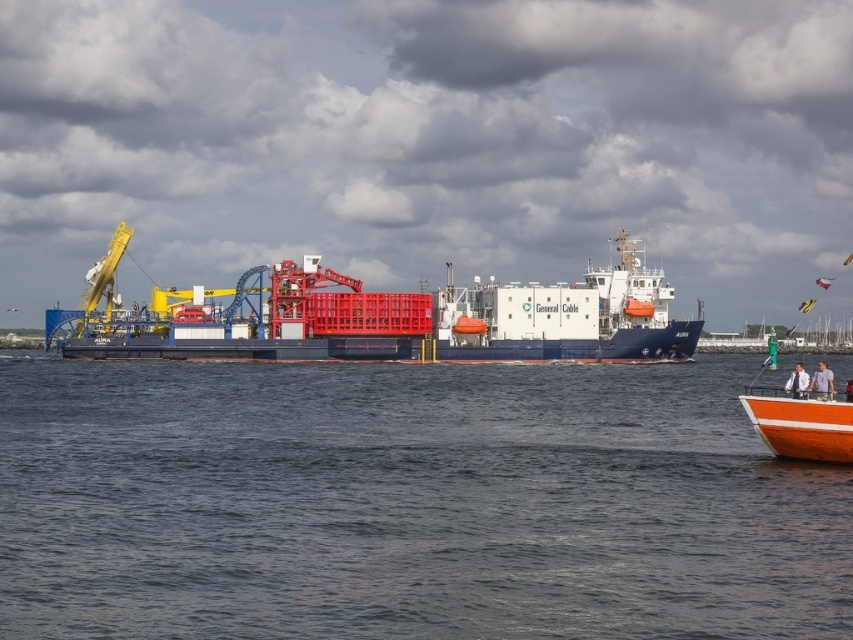
Based on the photo, you are a sailor on the orange boat with two people. You need to navigate to the point marked at coordinates (x=407, y=502). According to the scene, where is this point located?

The point marked at coordinates (x=407, y=502) is located on the dark blue water at center, so you should head towards the center of the water area in the image.

From the picture: You are a sailor on the orange boat in the foreground. You need to navigate your boat to the blue matte cargo ship at center. According to the scene, which direction should you steer your boat relative to the dark blue water at center?

The dark blue water at center is to the right of the blue matte cargo ship at center, so you should steer your boat to the left relative to the dark blue water at center to reach the blue matte cargo ship at center.

You are a sailor on a boat and need to know the distance between the dark blue water at center and the blue matte cargo ship at center. Can you determine if the distance is more than 15 meters?

The distance between the dark blue water at center and the blue matte cargo ship at center is 17.42 meters, which is more than 15 meters.